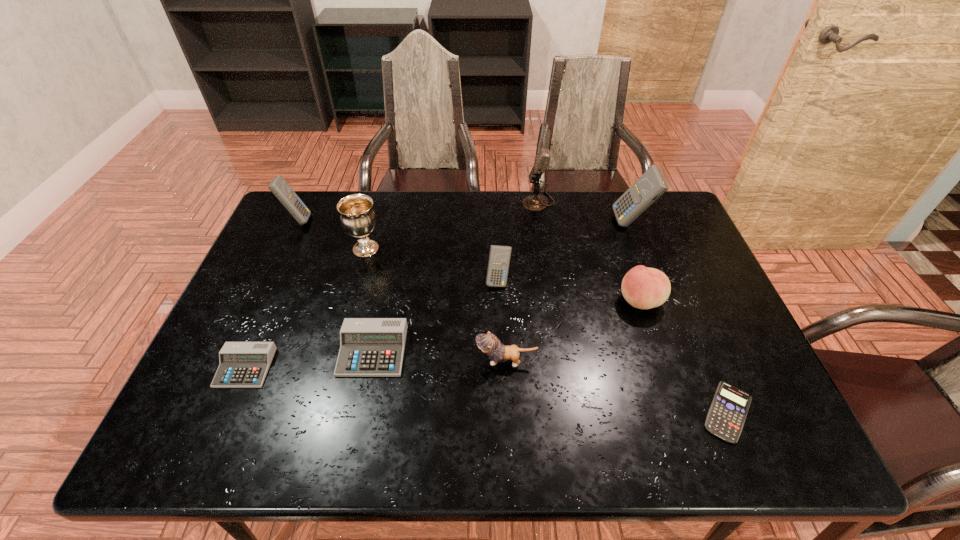
Locate an element on the screen. Image resolution: width=960 pixels, height=540 pixels. vacant space that satisfies the following two spatial constraints: 1. on the front-facing side of the fourth tallest calculator; 2. on the right side of the leftmost blue calculator is located at coordinates (238, 350).

Where is `vacant space that satisfies the following two spatial constraints: 1. on the front-facing side of the tallest calculator; 2. on the front side of the fourth tallest calculator`? This screenshot has height=540, width=960. vacant space that satisfies the following two spatial constraints: 1. on the front-facing side of the tallest calculator; 2. on the front side of the fourth tallest calculator is located at coordinates click(680, 350).

In order to click on vacant region that satisfies the following two spatial constraints: 1. on the front-facing side of the shortest calculator; 2. on the left side of the third blue calculator from right to left in this screenshot , I will do `click(503, 411)`.